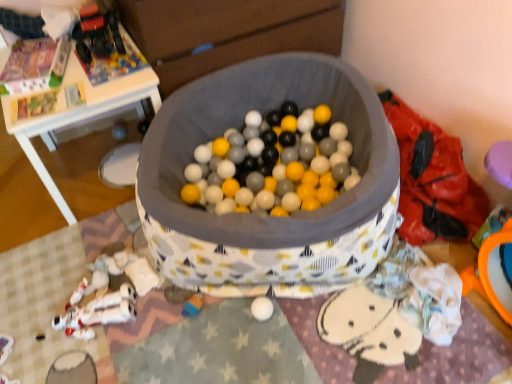
Identify the location of vacant area on top of white plastic table at upper left (from a real-world perspective). This screenshot has width=512, height=384. (69, 66).